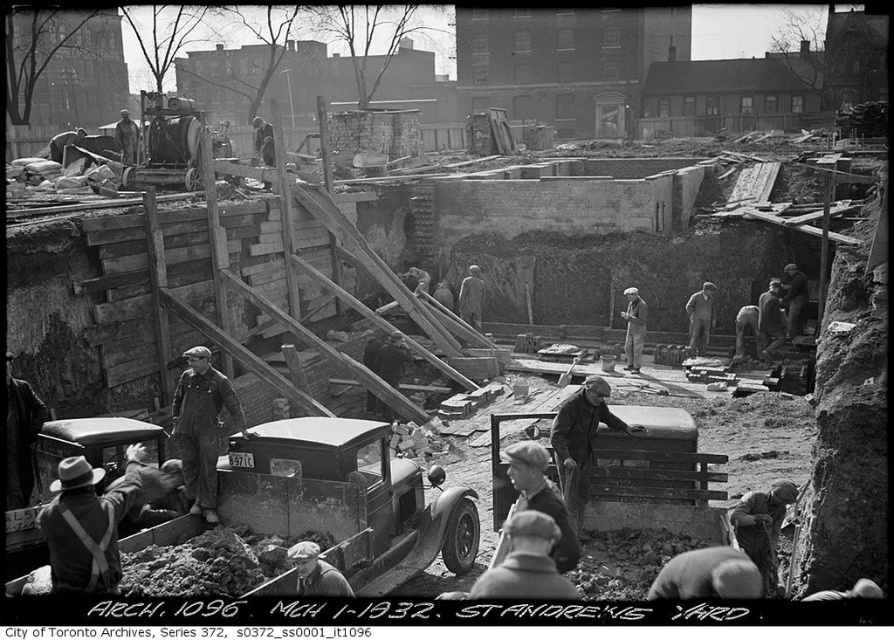
Question: Estimate the real-world distances between objects in this image. Which object is farther from the dark gray fabric jacket at center?

Choices:
 (A) matte gray cap at lower center
 (B) light gray fabric cap at center

Answer: (A)

Question: From the image, what is the correct spatial relationship of dark gray fabric jacket at center in relation to smooth gray suit at center?

Choices:
 (A) below
 (B) above

Answer: (A)

Question: Does dark gray wool jacket at lower center have a larger size compared to smooth gray cap at center?

Choices:
 (A) yes
 (B) no

Answer: (B)

Question: Considering the real-world distances, which object is closest to the dark gray overalls at center?

Choices:
 (A) matte gray cap at lower center
 (B) dark gray fabric jacket at right

Answer: (A)

Question: Considering the real-world distances, which object is farthest from the dark brown leather jacket at center?

Choices:
 (A) light gray fabric cap at center
 (B) dark gray overalls at center
 (C) dark gray wool jacket at lower center

Answer: (A)

Question: Where is dark gray fabric jacket at center located in relation to smooth leather jacket at center in the image?

Choices:
 (A) left
 (B) right

Answer: (A)